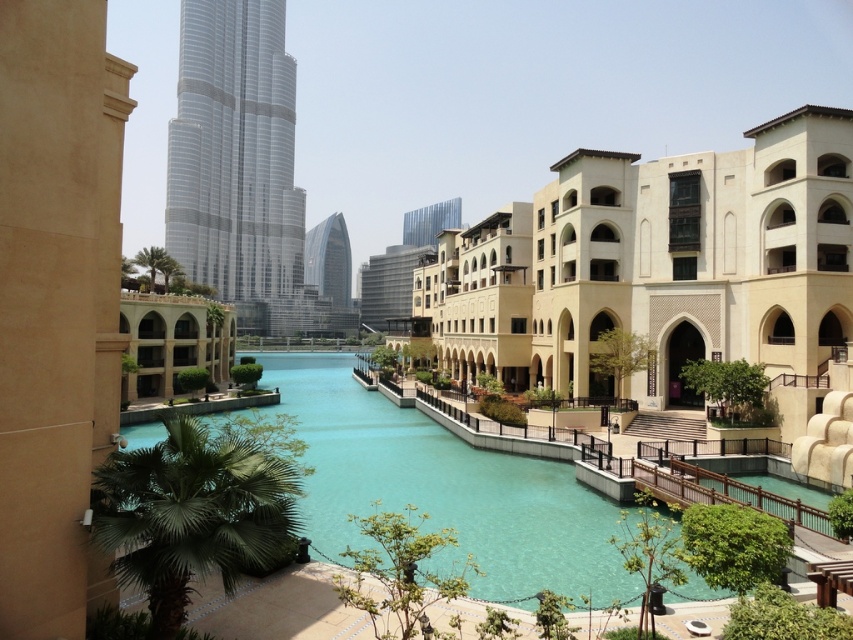
Question: Does green leafy palm tree at lower left have a lesser width compared to green leafy palm tree at upper center?

Choices:
 (A) yes
 (B) no

Answer: (A)

Question: Which is nearer to the shiny glass tower at center?

Choices:
 (A) green leafy palm tree at lower left
 (B) glassy silver tower at center
 (C) turquoise glassy water at center

Answer: (B)

Question: Does green leafy palm tree at lower left have a smaller size compared to green leafy palm tree at upper center?

Choices:
 (A) no
 (B) yes

Answer: (B)

Question: Which point is farther to the camera?

Choices:
 (A) beige stone building at center
 (B) green leafy palm tree at upper center
 (C) green leafy palm tree at center

Answer: (B)

Question: Can you confirm if beige stone building at center is positioned above green leafy palm tree at upper center?

Choices:
 (A) yes
 (B) no

Answer: (B)

Question: Estimate the real-world distances between objects in this image. Which object is farther from the shiny glass tower at center?

Choices:
 (A) turquoise glassy water at center
 (B) green leafy palm tree at lower left
 (C) glassy silver tower at center
 (D) beige stone building at center

Answer: (B)